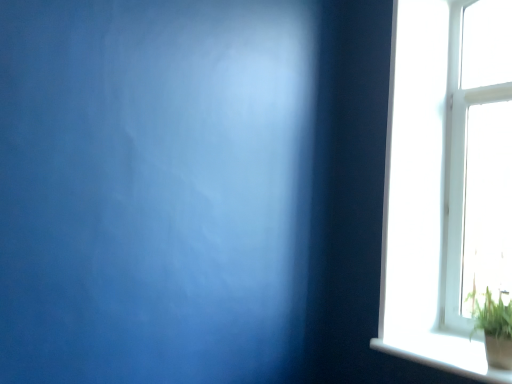
The image size is (512, 384). Find the location of `white glossy window sill at lower right`. white glossy window sill at lower right is located at coordinates 443,354.

What is the approximate height of white glossy window sill at lower right?

white glossy window sill at lower right is 1.90 inches tall.

This screenshot has height=384, width=512. Describe the element at coordinates (443, 354) in the screenshot. I see `white glossy window sill at lower right` at that location.

This screenshot has height=384, width=512. In order to click on green leafy plant at bottom right in this screenshot , I will do `click(493, 328)`.

Measure the distance between green leafy plant at bottom right and camera.

green leafy plant at bottom right is 1.88 meters away from camera.

Image resolution: width=512 pixels, height=384 pixels. Describe the element at coordinates (493, 328) in the screenshot. I see `green leafy plant at bottom right` at that location.

At what (x,y) coordinates should I click in order to perform the action: click on white glossy window sill at lower right. Please return your answer as a coordinate pair (x, y). The width and height of the screenshot is (512, 384). Looking at the image, I should click on (443, 354).

Between green leafy plant at bottom right and white glossy window sill at lower right, which one appears on the left side from the viewer's perspective?

white glossy window sill at lower right is more to the left.

Is green leafy plant at bottom right further to the viewer compared to white glossy window sill at lower right?

Yes, green leafy plant at bottom right is further from the viewer.

Is point (486, 319) closer or farther from the camera than point (507, 382)?

Point (486, 319).

From the image's perspective, which object appears higher, green leafy plant at bottom right or white glossy window sill at lower right?

green leafy plant at bottom right, from the image's perspective.

From a real-world perspective, is green leafy plant at bottom right under white glossy window sill at lower right?

No.

Considering the sizes of objects green leafy plant at bottom right and white glossy window sill at lower right in the image provided, who is wider, green leafy plant at bottom right or white glossy window sill at lower right?

white glossy window sill at lower right is wider.

Considering the relative sizes of green leafy plant at bottom right and white glossy window sill at lower right in the image provided, is green leafy plant at bottom right shorter than white glossy window sill at lower right?

No.

Does green leafy plant at bottom right have a smaller size compared to white glossy window sill at lower right?

→ No.

Is green leafy plant at bottom right spatially inside white glossy window sill at lower right, or outside of it?

green leafy plant at bottom right lies outside white glossy window sill at lower right.

Is green leafy plant at bottom right beside white glossy window sill at lower right?

No, green leafy plant at bottom right is not beside white glossy window sill at lower right.

Is green leafy plant at bottom right turned away from white glossy window sill at lower right?

No, green leafy plant at bottom right is not facing the opposite direction of white glossy window sill at lower right.

How different are the orientations of green leafy plant at bottom right and white glossy window sill at lower right in degrees?

0.000273 degrees.

How much distance is there between green leafy plant at bottom right and white glossy window sill at lower right?

The distance of green leafy plant at bottom right from white glossy window sill at lower right is 20.20 centimeters.

I want to click on houseplant located on the right of white glossy window sill at lower right, so click(x=493, y=328).

Which is more to the right, white glossy window sill at lower right or green leafy plant at bottom right?

green leafy plant at bottom right.

Which is behind, white glossy window sill at lower right or green leafy plant at bottom right?

green leafy plant at bottom right.

Is point (468, 347) closer to viewer compared to point (497, 332)?

No, (468, 347) is behind (497, 332).

From the image's perspective, between white glossy window sill at lower right and green leafy plant at bottom right, who is located below?

white glossy window sill at lower right.

From a real-world perspective, relative to green leafy plant at bottom right, is white glossy window sill at lower right vertically above or below?

From a real-world perspective, white glossy window sill at lower right is physically below green leafy plant at bottom right.

Is white glossy window sill at lower right thinner than green leafy plant at bottom right?

No, white glossy window sill at lower right is not thinner than green leafy plant at bottom right.

Which of these two, white glossy window sill at lower right or green leafy plant at bottom right, stands shorter?

Standing shorter between the two is white glossy window sill at lower right.

Looking at the image, does white glossy window sill at lower right seem bigger or smaller compared to green leafy plant at bottom right?

white glossy window sill at lower right is smaller than green leafy plant at bottom right.

Is green leafy plant at bottom right a part of white glossy window sill at lower right?

Actually, green leafy plant at bottom right is outside white glossy window sill at lower right.

Is white glossy window sill at lower right not close to green leafy plant at bottom right?

No, white glossy window sill at lower right is in close proximity to green leafy plant at bottom right.

Could you tell me if white glossy window sill at lower right is facing green leafy plant at bottom right?

No.

How many degrees apart are the facing directions of white glossy window sill at lower right and green leafy plant at bottom right?

The angle between the facing direction of white glossy window sill at lower right and the facing direction of green leafy plant at bottom right is 0.000273 degrees.

Based on the photo, measure the distance from white glossy window sill at lower right to green leafy plant at bottom right.

7.95 inches.

The height and width of the screenshot is (384, 512). In order to click on window sill below the green leafy plant at bottom right (from the image's perspective) in this screenshot , I will do `click(443, 354)`.

At what (x,y) coordinates should I click in order to perform the action: click on houseplant that appears above the white glossy window sill at lower right (from a real-world perspective). Please return your answer as a coordinate pair (x, y). Image resolution: width=512 pixels, height=384 pixels. Looking at the image, I should click on (493, 328).

This screenshot has width=512, height=384. In order to click on window sill in front of the green leafy plant at bottom right in this screenshot , I will do `click(443, 354)`.